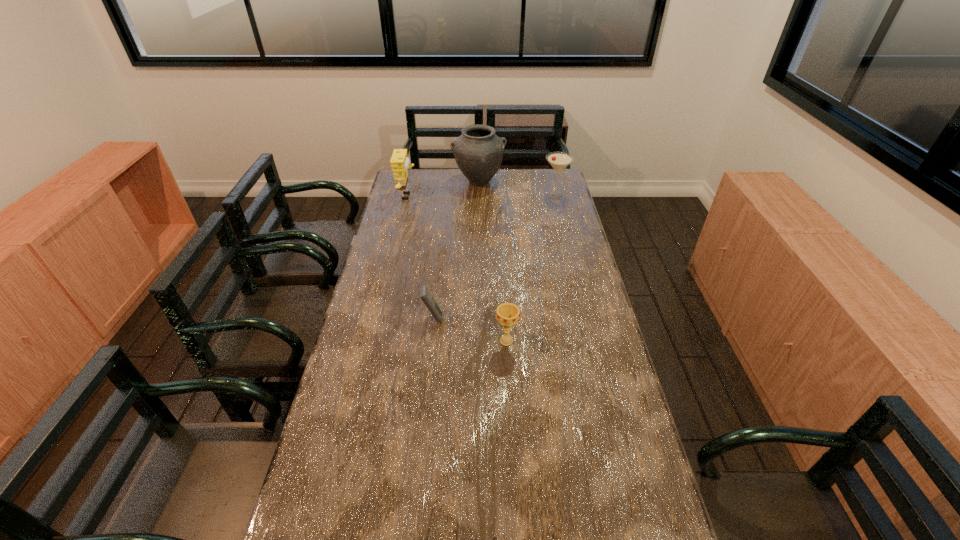
The width and height of the screenshot is (960, 540). What are the coordinates of `free space that is in between the leftmost object and the chalice` in the screenshot? It's located at (457, 269).

Image resolution: width=960 pixels, height=540 pixels. Identify the location of vacant area between the second nearest object and the tallest object. (492, 261).

At what (x,y) coordinates should I click in order to perform the action: click on free space that is in between the tallest object and the sponge. Please return your answer as a coordinate pair (x, y). The width and height of the screenshot is (960, 540). Looking at the image, I should click on (444, 189).

This screenshot has width=960, height=540. I want to click on object that can be found as the closest to the sponge, so click(x=478, y=152).

Find the location of a particular element. The width and height of the screenshot is (960, 540). object that is the fifth closest one to the rightmost object is located at coordinates (495, 537).

At what (x,y) coordinates should I click in order to perform the action: click on free location that satisfies the following two spatial constraints: 1. on the front-facing side of the fifth farthest object; 2. on the right side of the calculator. Please return your answer as a coordinate pair (x, y). Image resolution: width=960 pixels, height=540 pixels. Looking at the image, I should click on (430, 341).

You are a GUI agent. You are given a task and a screenshot of the screen. Output one action in this format:
    pyautogui.click(x=<x>, y=<y>)
    Task: Click on the vacant space that satisfies the following two spatial constraints: 1. on the front side of the rightmost object; 2. on the left side of the tallest object
    This screenshot has height=540, width=960.
    Given the screenshot: What is the action you would take?
    pyautogui.click(x=479, y=195)

Image resolution: width=960 pixels, height=540 pixels. What are the coordinates of `vacant region that satisfies the following two spatial constraints: 1. on the front side of the martini; 2. on the right side of the tallest object` in the screenshot? It's located at (479, 195).